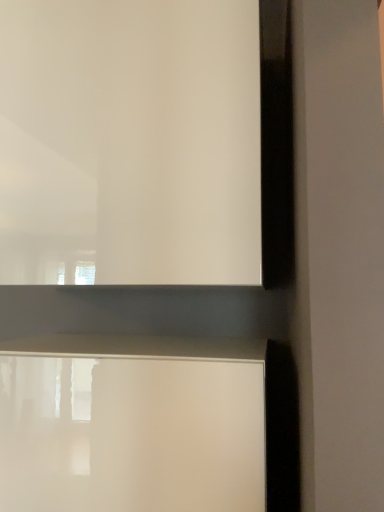
Measure the distance between white glossy window frame at upper center and camera.

They are 28.36 inches apart.

In order to face white glossy window frame at upper center, should I rotate leftwards or rightwards?

Turn left approximately 8.218 degrees to face it.

What do you see at coordinates (145, 143) in the screenshot? I see `white glossy window frame at upper center` at bounding box center [145, 143].

What are the coordinates of `white glossy window frame at upper center` in the screenshot? It's located at (145, 143).

Where is `white glossy table at lower center`? This screenshot has width=384, height=512. white glossy table at lower center is located at coordinates tap(131, 433).

The width and height of the screenshot is (384, 512). Describe the element at coordinates (131, 433) in the screenshot. I see `white glossy table at lower center` at that location.

The image size is (384, 512). What are the coordinates of `white glossy window frame at upper center` in the screenshot? It's located at (145, 143).

In the image, is white glossy window frame at upper center on the left side or the right side of white glossy table at lower center?

From the image, it's evident that white glossy window frame at upper center is to the right of white glossy table at lower center.

Considering the relative positions of white glossy window frame at upper center and white glossy table at lower center in the image provided, is white glossy window frame at upper center in front of white glossy table at lower center?

No, it is behind white glossy table at lower center.

Does point (94, 61) appear closer or farther from the camera than point (10, 493)?

Point (94, 61) is positioned farther from the camera compared to point (10, 493).

From the image's perspective, is white glossy window frame at upper center under white glossy table at lower center?

No, from the image's perspective, white glossy window frame at upper center is not below white glossy table at lower center.

From a real-world perspective, is white glossy window frame at upper center physically located above or below white glossy table at lower center?

white glossy window frame at upper center is above white glossy table at lower center.

Between white glossy window frame at upper center and white glossy table at lower center, which one has smaller width?

white glossy table at lower center.

In terms of height, does white glossy window frame at upper center look taller or shorter compared to white glossy table at lower center?

Clearly, white glossy window frame at upper center is taller compared to white glossy table at lower center.

Is white glossy window frame at upper center smaller than white glossy table at lower center?

Incorrect, white glossy window frame at upper center is not smaller in size than white glossy table at lower center.

In the scene shown: Is white glossy table at lower center completely or partially inside white glossy window frame at upper center?

No, white glossy window frame at upper center does not contain white glossy table at lower center.

Is white glossy window frame at upper center not near white glossy table at lower center?

They are positioned close to each other.

Is white glossy window frame at upper center aimed at white glossy table at lower center?

No, white glossy window frame at upper center does not turn towards white glossy table at lower center.

What's the angular difference between white glossy window frame at upper center and white glossy table at lower center's facing directions?

They differ by 3.58e-05 degrees in their facing directions.

The height and width of the screenshot is (512, 384). I want to click on table below the white glossy window frame at upper center (from a real-world perspective), so pos(131,433).

Can you confirm if white glossy table at lower center is positioned to the right of white glossy window frame at upper center?

In fact, white glossy table at lower center is to the left of white glossy window frame at upper center.

Is white glossy table at lower center positioned behind white glossy window frame at upper center?

No, white glossy table at lower center is in front of white glossy window frame at upper center.

Which is behind, point (250, 506) or point (125, 196)?

The point (125, 196) is farther.

From the image's perspective, between white glossy table at lower center and white glossy window frame at upper center, who is located below?

white glossy table at lower center is shown below in the image.

From a real-world perspective, which is physically above, white glossy table at lower center or white glossy window frame at upper center?

white glossy window frame at upper center is physically above.

Which of these two, white glossy table at lower center or white glossy window frame at upper center, is wider?

Wider between the two is white glossy window frame at upper center.

Between white glossy table at lower center and white glossy window frame at upper center, which one has less height?

white glossy table at lower center is shorter.

Considering the sizes of white glossy table at lower center and white glossy window frame at upper center in the image, is white glossy table at lower center bigger or smaller than white glossy window frame at upper center?

Considering their sizes, white glossy table at lower center takes up less space than white glossy window frame at upper center.

Is white glossy table at lower center spatially inside white glossy window frame at upper center, or outside of it?

white glossy table at lower center exists outside the volume of white glossy window frame at upper center.

Is white glossy table at lower center far from white glossy window frame at upper center?

No, white glossy table at lower center is not far from white glossy window frame at upper center.

Is white glossy window frame at upper center at the back of white glossy table at lower center?

No.

Can you tell me how much white glossy table at lower center and white glossy window frame at upper center differ in facing direction?

The angle between the facing direction of white glossy table at lower center and the facing direction of white glossy window frame at upper center is 3.58e-05 degrees.

Locate an element on the screen. This screenshot has height=512, width=384. table that appears below the white glossy window frame at upper center (from a real-world perspective) is located at coordinates click(x=131, y=433).

This screenshot has width=384, height=512. In order to click on window frame on the right of the white glossy table at lower center in this screenshot , I will do `click(145, 143)`.

You are a GUI agent. You are given a task and a screenshot of the screen. Output one action in this format:
    pyautogui.click(x=<x>, y=<y>)
    Task: Click on the window frame above the white glossy table at lower center (from the image's perspective)
    The width and height of the screenshot is (384, 512).
    Given the screenshot: What is the action you would take?
    pyautogui.click(x=145, y=143)